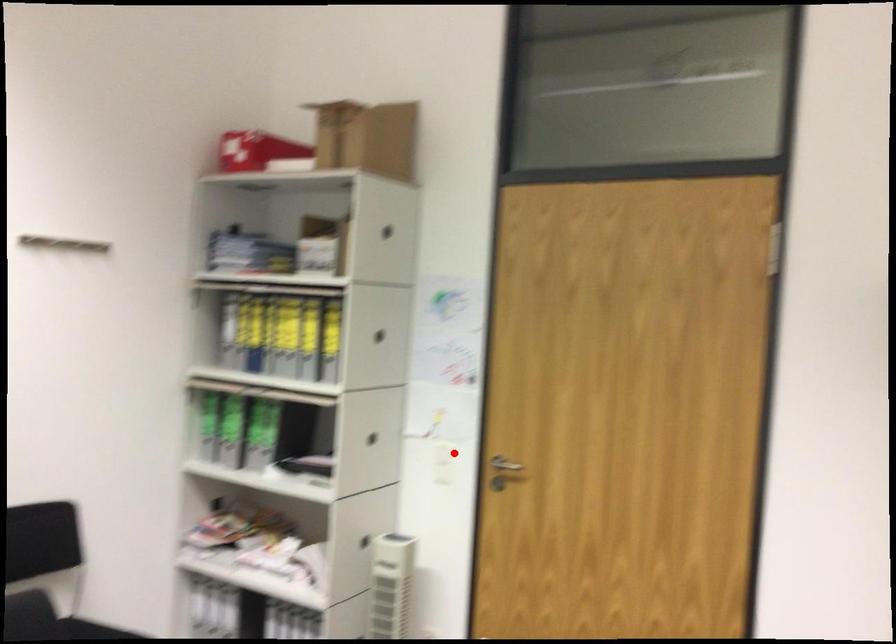
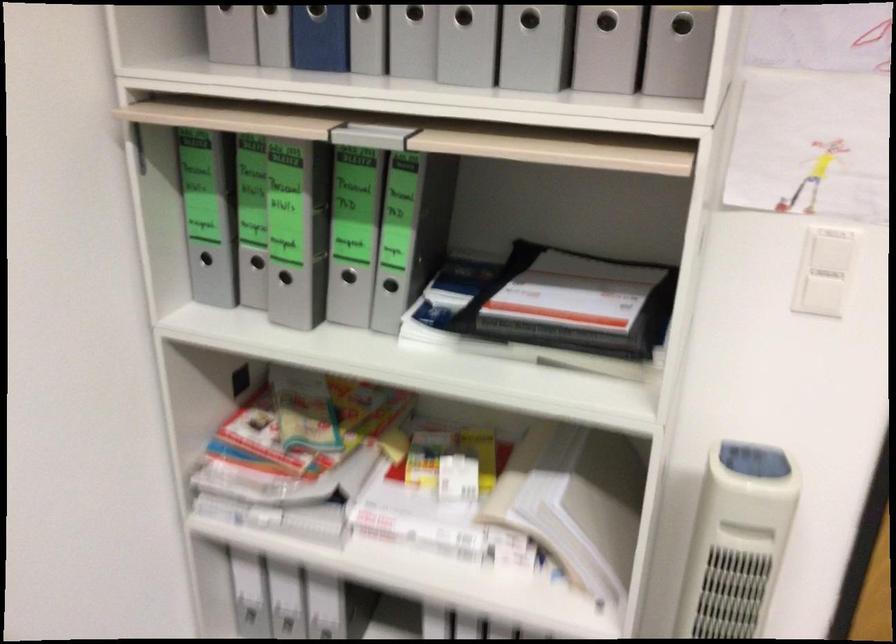
Find the pixel in the second image that matches the highlighted location in the first image.

(831, 252)